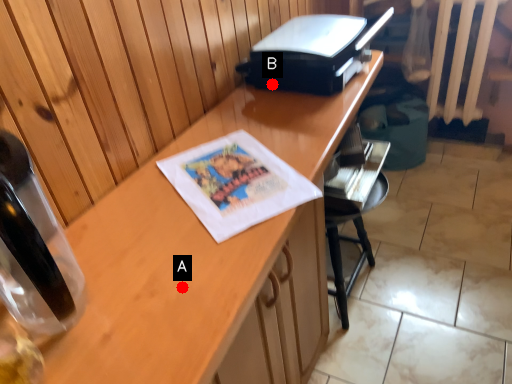
Question: Two points are circled on the image, labeled by A and B beside each circle. Which point appears closest to the camera in this image?

Choices:
 (A) A is closer
 (B) B is closer

Answer: (A)